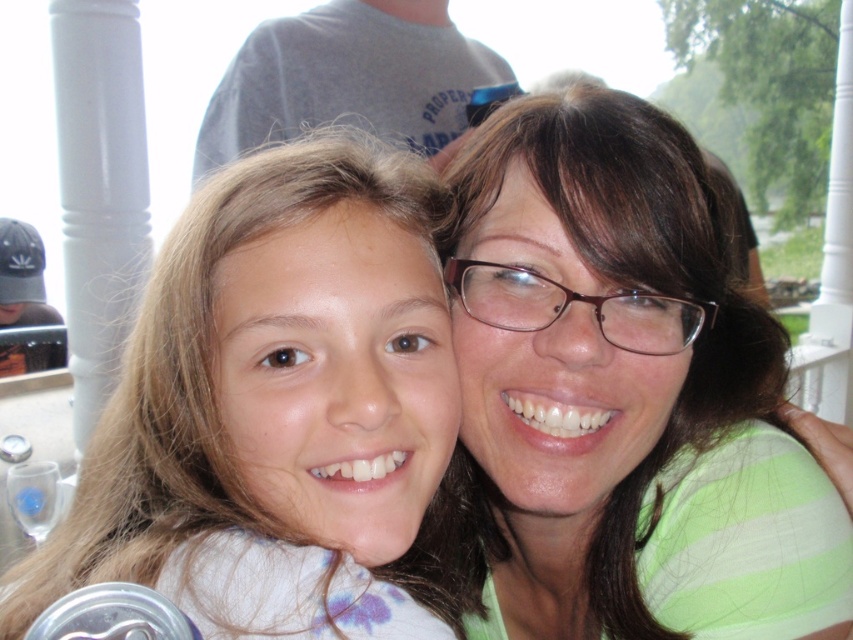
Question: Considering the real-world distances, which object is farthest from the gray t-shirt at upper center?

Choices:
 (A) light brown hair at center
 (B) matte green shirt at center

Answer: (A)

Question: Which point appears closest to the camera in this image?

Choices:
 (A) (611, 609)
 (B) (433, 3)
 (C) (134, 419)

Answer: (C)

Question: Does light brown hair at center lie behind gray t-shirt at upper center?

Choices:
 (A) yes
 (B) no

Answer: (B)

Question: Can you confirm if light brown hair at center is positioned above gray t-shirt at upper center?

Choices:
 (A) no
 (B) yes

Answer: (A)

Question: Is matte green shirt at center closer to camera compared to gray t-shirt at upper center?

Choices:
 (A) no
 (B) yes

Answer: (B)

Question: Which point is farther from the camera taking this photo?

Choices:
 (A) (346, 8)
 (B) (682, 621)

Answer: (A)